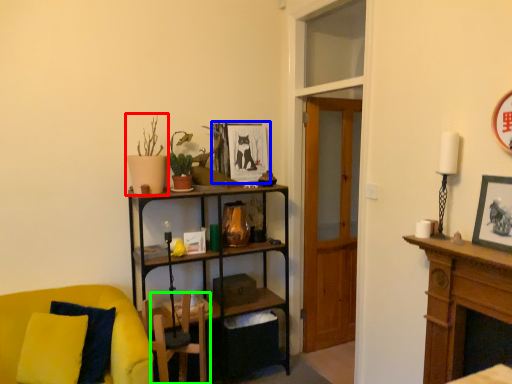
Question: Considering the real-world distances, which object is closest to houseplant (highlighted by a red box)? picture frame (highlighted by a blue box) or swivel chair (highlighted by a green box).

Choices:
 (A) picture frame
 (B) swivel chair

Answer: (A)